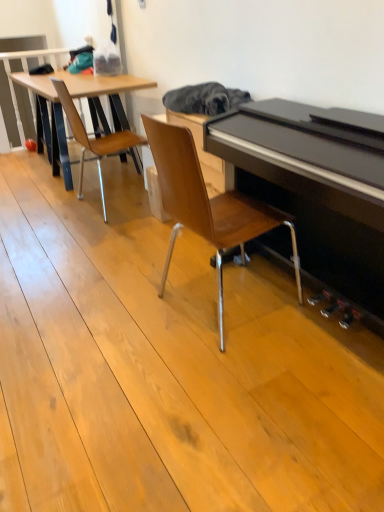
What are the coordinates of `free location to the right of wooden chair at center, which is the first chair from front to back` in the screenshot? It's located at (316, 325).